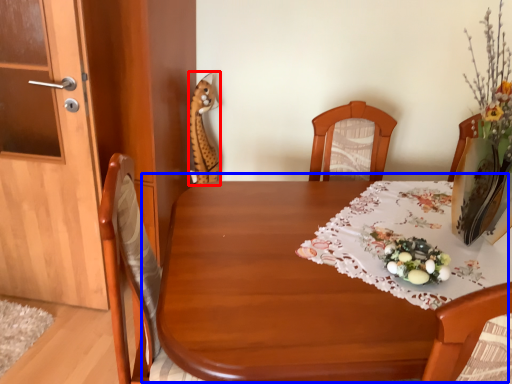
Question: Which object appears farthest to the camera in this image, animal (highlighted by a red box) or table (highlighted by a blue box)?

Choices:
 (A) animal
 (B) table

Answer: (A)